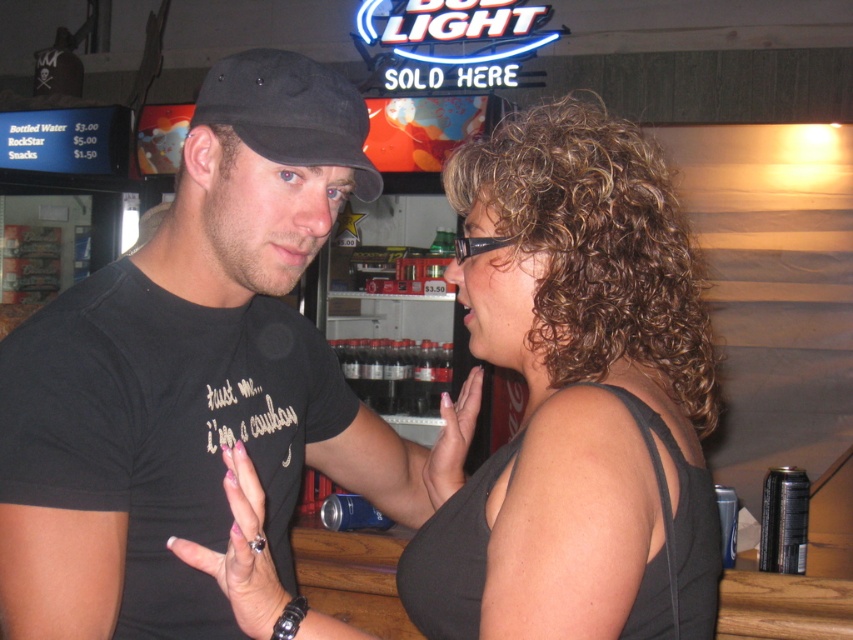
Can you confirm if black matte t-shirt at center is positioned below dark glass bottles at center?

No, black matte t-shirt at center is not below dark glass bottles at center.

Between black matte t-shirt at center and dark glass bottles at center, which one is positioned lower?

Positioned lower is dark glass bottles at center.

This screenshot has height=640, width=853. I want to click on black matte t-shirt at center, so click(x=192, y=376).

Where is `black matte t-shirt at center`? The image size is (853, 640). black matte t-shirt at center is located at coordinates (192, 376).

This screenshot has height=640, width=853. What do you see at coordinates (289, 113) in the screenshot? I see `black fabric baseball cap at upper left` at bounding box center [289, 113].

Is black fabric baseball cap at upper left to the right of dark glass bottles at center from the viewer's perspective?

Indeed, black fabric baseball cap at upper left is positioned on the right side of dark glass bottles at center.

Where is `black fabric baseball cap at upper left`? This screenshot has height=640, width=853. black fabric baseball cap at upper left is located at coordinates (289, 113).

Locate an element on the screen. Image resolution: width=853 pixels, height=640 pixels. black fabric baseball cap at upper left is located at coordinates (289, 113).

Can you confirm if matte black tank top at center is positioned above dark glass bottles at center?

Indeed, matte black tank top at center is positioned over dark glass bottles at center.

Is point (643, 428) farther from camera compared to point (425, 376)?

That is False.

Where is `matte black tank top at center`? This screenshot has height=640, width=853. matte black tank top at center is located at coordinates (577, 396).